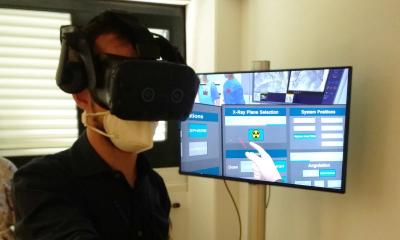
The image size is (400, 240). I want to click on tv screen, so click(x=290, y=102).